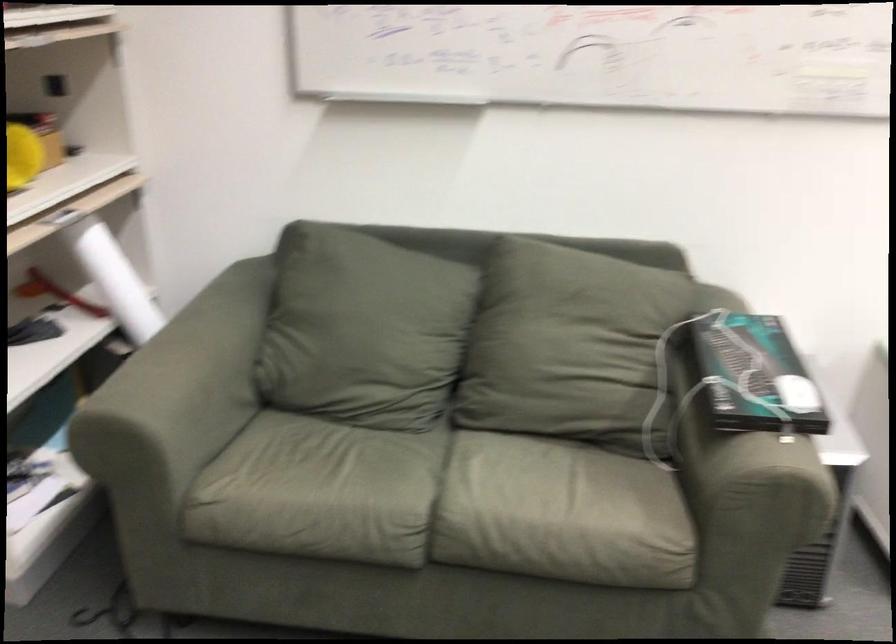
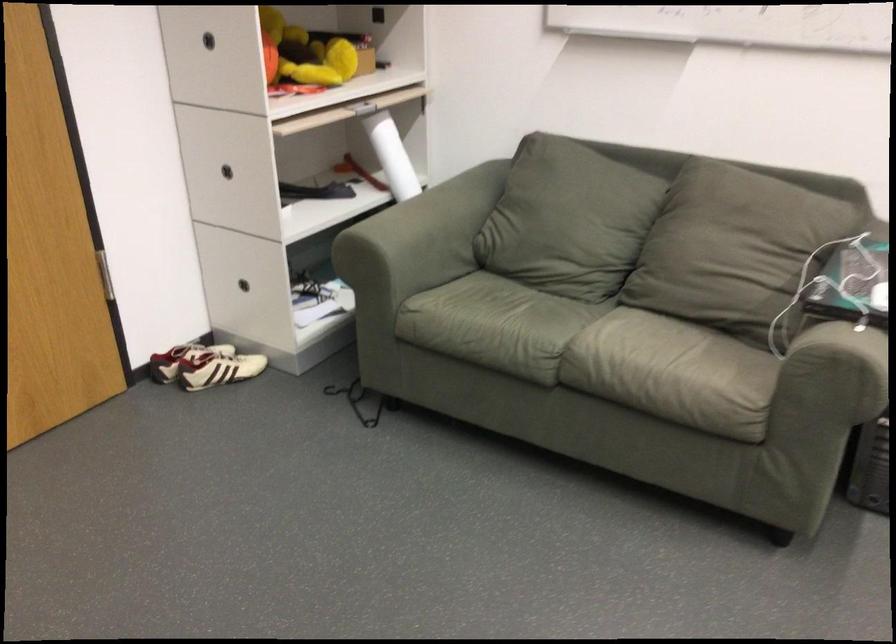
In the second image, find the point that corresponds to the point at 574,343 in the first image.

(728, 243)